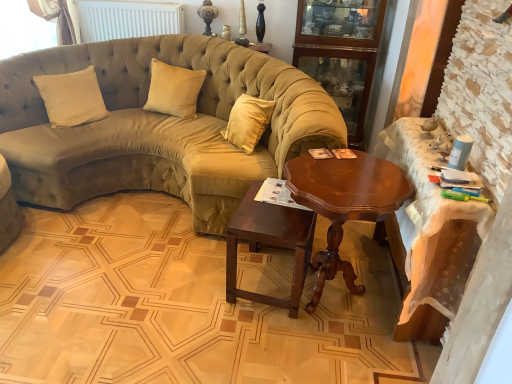
Locate an element on the screen. The image size is (512, 384). free space that is to the left of mahogany wood side table at center, marked as the 1th table in a left-to-right arrangement is located at coordinates [184, 288].